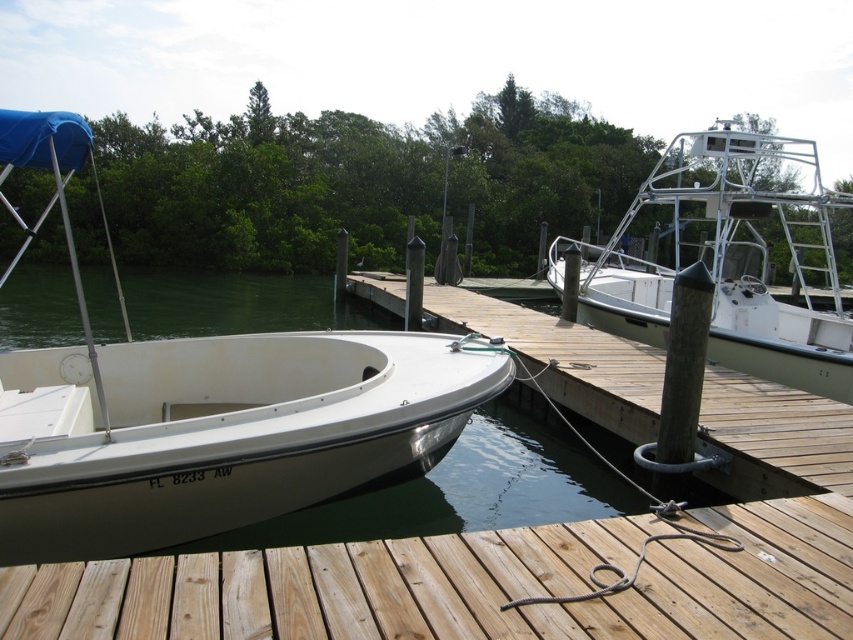
Between wooden dock at lower center and light brown wood at lower center, which one is positioned lower?

light brown wood at lower center is lower down.

Is wooden dock at lower center above light brown wood at lower center?

Yes, wooden dock at lower center is above light brown wood at lower center.

Does point (567, 346) come in front of point (216, 589)?

No.

Find the location of a particular element. Image resolution: width=853 pixels, height=640 pixels. wooden dock at lower center is located at coordinates (469, 561).

Who is more forward, (248, 598) or (51, 456)?

A: Point (248, 598)

Between wooden dock at lower center and white matte boat at left, which one appears on the right side from the viewer's perspective?

Positioned to the right is wooden dock at lower center.

The height and width of the screenshot is (640, 853). I want to click on wooden dock at lower center, so click(469, 561).

Does wooden dock at lower center appear over white metallic boat at upper right?

No.

From the picture: Does wooden dock at lower center appear on the left side of white metallic boat at upper right?

Correct, you'll find wooden dock at lower center to the left of white metallic boat at upper right.

Locate an element on the screen. The image size is (853, 640). wooden dock at lower center is located at coordinates (469, 561).

Find the location of a particular element. wooden dock at lower center is located at coordinates (469, 561).